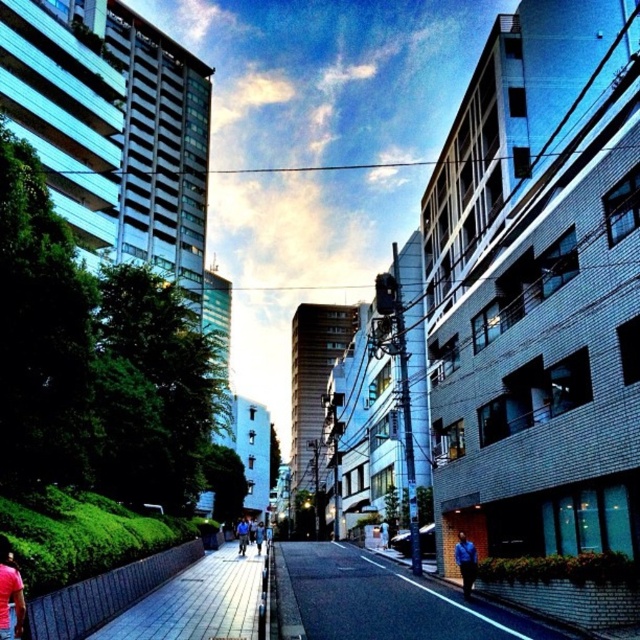
Is paved stone sidewalk at center to the right of blue denim jacket at center from the viewer's perspective?

Correct, you'll find paved stone sidewalk at center to the right of blue denim jacket at center.

Is point (262, 554) behind point (243, 516)?

That is False.

I want to click on paved stone sidewalk at center, so click(x=196, y=602).

Can you confirm if paved stone sidewalk at center is smaller than blue shirt at center?

Actually, paved stone sidewalk at center might be larger than blue shirt at center.

Can you confirm if paved stone sidewalk at center is wider than blue shirt at center?

Indeed, paved stone sidewalk at center has a greater width compared to blue shirt at center.

Between point (195, 609) and point (461, 536), which one is positioned in front?

Point (195, 609) is in front.

Where is `paved stone sidewalk at center`? The image size is (640, 640). paved stone sidewalk at center is located at coordinates (196, 602).

Measure the distance between point (456, 545) and camera.

Point (456, 545) and camera are 19.47 meters apart from each other.

Can you confirm if blue shirt at center is shorter than blue denim jacket at center?

Correct, blue shirt at center is not as tall as blue denim jacket at center.

Is point (460, 564) more distant than point (243, 518)?

No.

Image resolution: width=640 pixels, height=640 pixels. I want to click on blue shirt at center, so [465, 563].